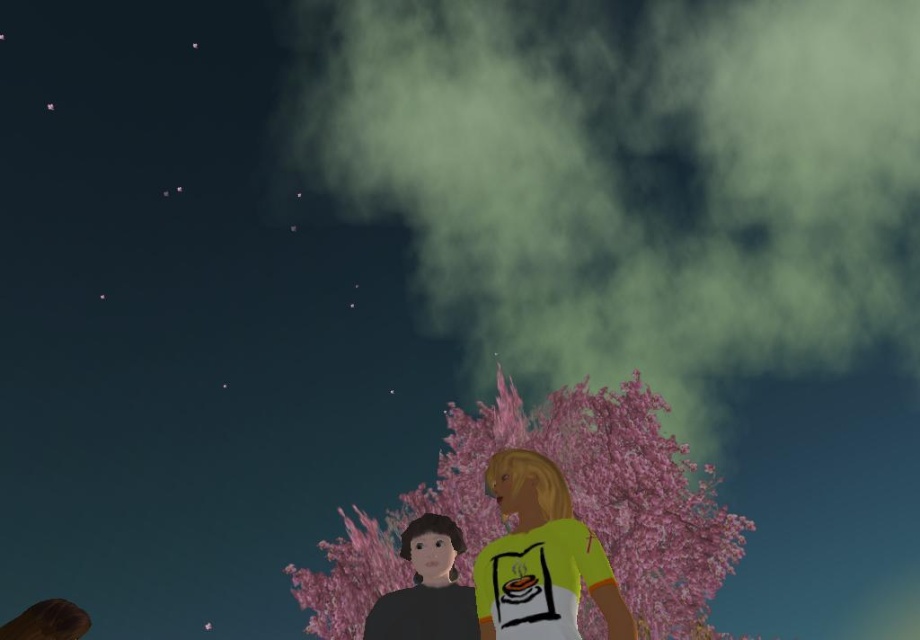
Question: Which object is the closest to the yellow matte shirt at center?

Choices:
 (A) matte black shirt at lower left
 (B) pink matte tree at center

Answer: (A)

Question: Can you confirm if pink matte tree at center is wider than matte black shirt at lower left?

Choices:
 (A) yes
 (B) no

Answer: (A)

Question: Which point appears closest to the camera in this image?

Choices:
 (A) (526, 598)
 (B) (452, 525)

Answer: (A)

Question: Can you confirm if pink matte tree at center is positioned to the right of matte black shirt at lower left?

Choices:
 (A) no
 (B) yes

Answer: (B)

Question: Which point appears closest to the camera in this image?

Choices:
 (A) click(443, 572)
 (B) click(500, 563)

Answer: (B)

Question: In this image, where is pink matte tree at center located relative to matte black shirt at lower left?

Choices:
 (A) below
 (B) above

Answer: (A)